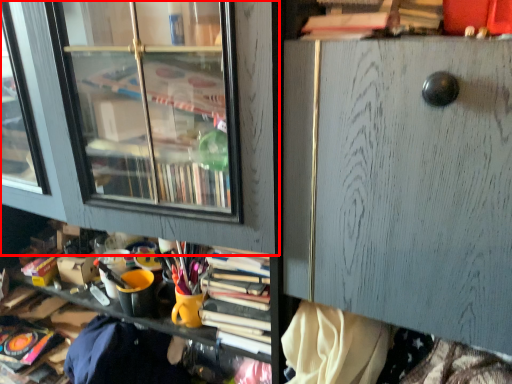
Question: Where is shelf (annotated by the red box) located in relation to file cabinet in the image?

Choices:
 (A) left
 (B) right

Answer: (A)